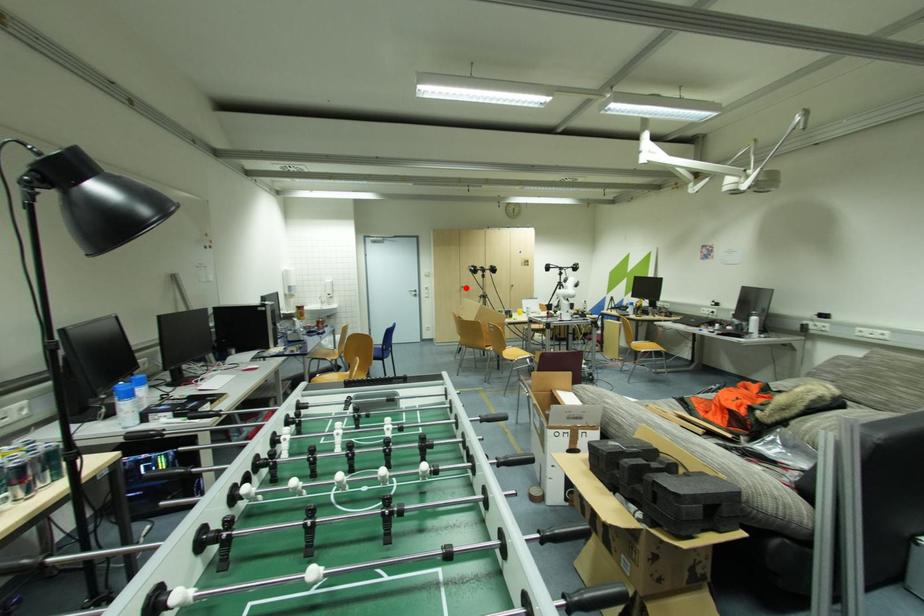
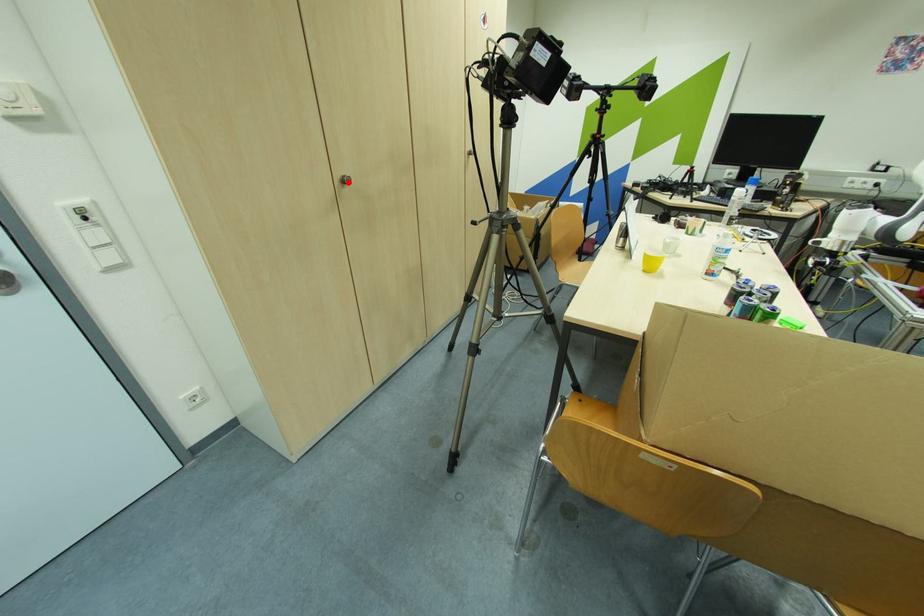
I am providing you with two images of the same scene from different viewpoints. A red point is marked on the first image and another point is marked on the second image. Is the red point in image1 aligned with the point shown in image2?

Yes